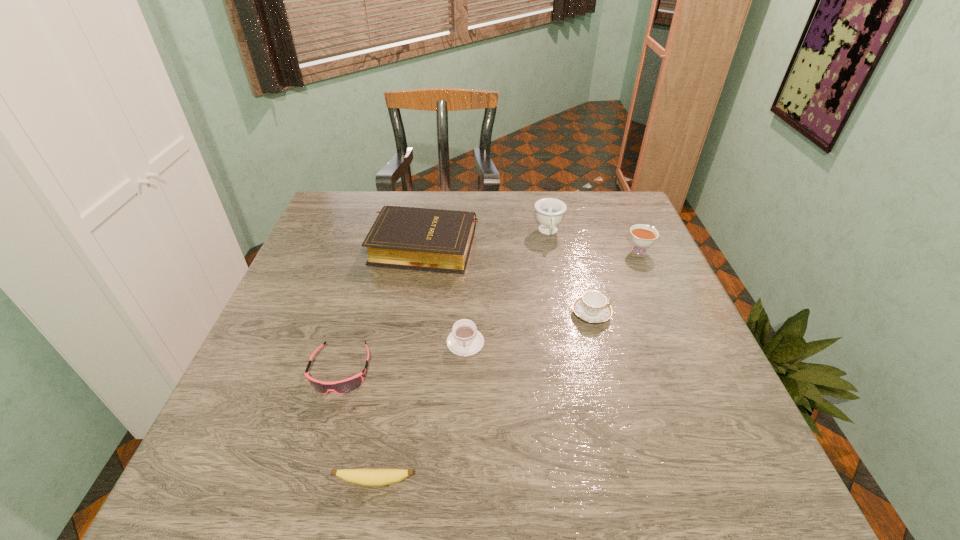
At what (x,y) coordinates should I click in order to perform the action: click on object located in the left edge section of the desktop. Please return your answer as a coordinate pair (x, y). Looking at the image, I should click on pyautogui.click(x=347, y=385).

What are the coordinates of `object that is at the right edge` in the screenshot? It's located at (642, 236).

In the image, there is a desktop. What are the coordinates of `vacant space at the far edge` in the screenshot? It's located at (471, 193).

Where is `free location at the near edge of the desktop`? free location at the near edge of the desktop is located at coordinates (503, 471).

The width and height of the screenshot is (960, 540). In order to click on vacant space at the left edge of the desktop in this screenshot , I will do `click(357, 270)`.

Identify the location of vacant area at the right edge. The height and width of the screenshot is (540, 960). (667, 402).

Image resolution: width=960 pixels, height=540 pixels. In the image, there is a desktop. Find the location of `free space at the far left corner`. free space at the far left corner is located at coordinates (359, 222).

Where is `unoccupied area between the goggles and the third shortest teacup`? The width and height of the screenshot is (960, 540). unoccupied area between the goggles and the third shortest teacup is located at coordinates (490, 310).

You are a GUI agent. You are given a task and a screenshot of the screen. Output one action in this format:
    pyautogui.click(x=<x>, y=<y>)
    Task: Click on the vacant area between the fourth nearest object and the leftmost teacup
    This screenshot has height=540, width=960.
    Given the screenshot: What is the action you would take?
    pyautogui.click(x=528, y=328)

Where is `vacant space that's between the tallest teacup and the Bible`? vacant space that's between the tallest teacup and the Bible is located at coordinates (487, 239).